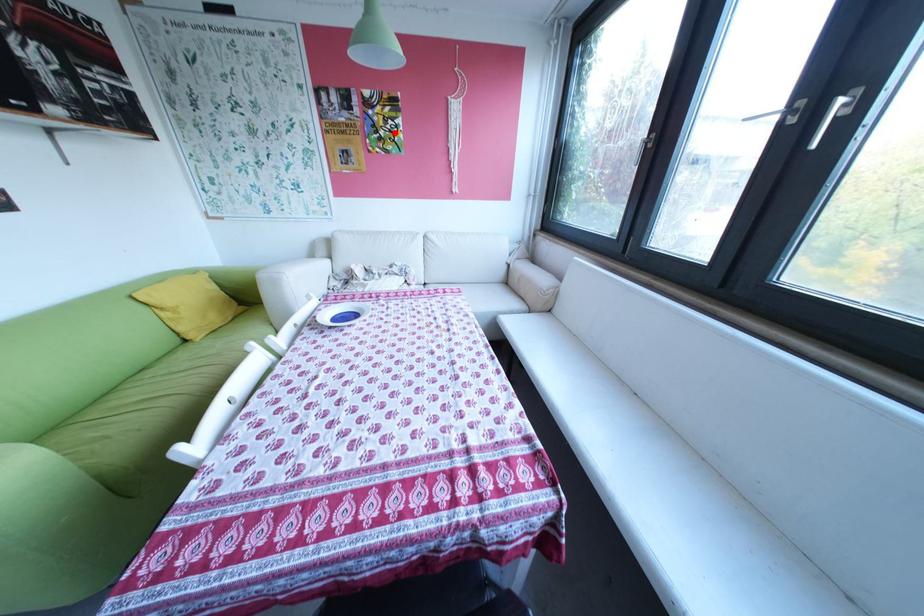
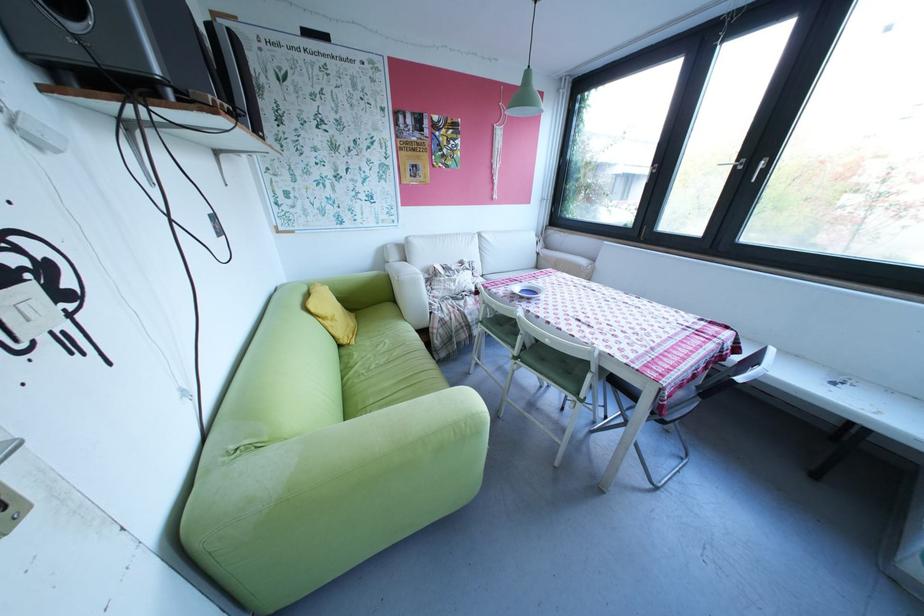
Where in the second image is the point corresponding to the highlighted location from the first image?

(457, 151)